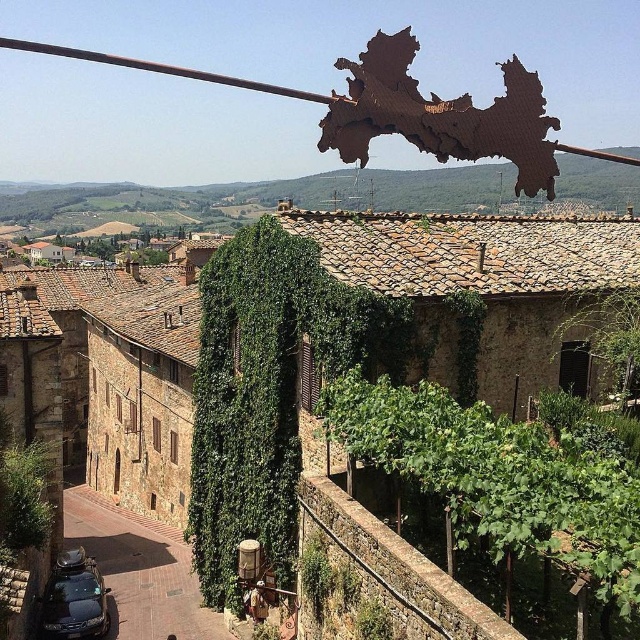
Question: Estimate the real-world distances between objects in this image. Which object is farther from the brown stone town at center?

Choices:
 (A) shiny black car at lower left
 (B) dark gray asphalt at lower left
 (C) green leafy ivy at lower right

Answer: (C)

Question: Is brown stone town at center positioned at the back of green leafy ivy at lower right?

Choices:
 (A) no
 (B) yes

Answer: (B)

Question: Based on their relative distances, which object is nearer to the shiny black car at lower left?

Choices:
 (A) dark gray asphalt at lower left
 (B) brown stone town at center
 (C) green leafy ivy at lower right

Answer: (A)

Question: Among these points, which one is nearest to the camera?

Choices:
 (A) (90, 556)
 (B) (68, 545)
 (C) (502, 460)

Answer: (C)

Question: Is green leafy ivy at lower right below shiny black car at lower left?

Choices:
 (A) no
 (B) yes

Answer: (A)

Question: In this image, where is brown stone town at center located relative to green leafy ivy at lower right?

Choices:
 (A) above
 (B) below

Answer: (A)